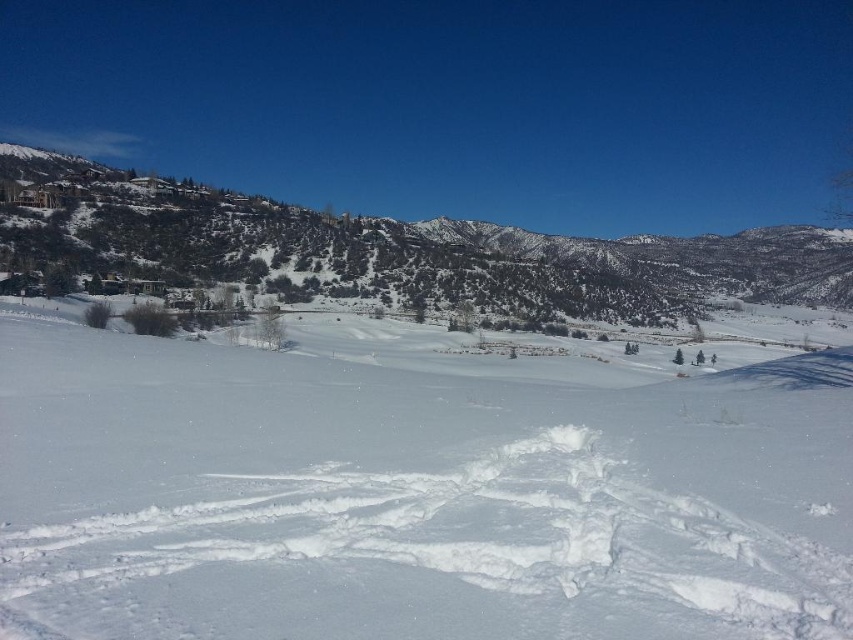
Question: Is white fluffy snow at center wider than green textured hillside at upper left?

Choices:
 (A) yes
 (B) no

Answer: (B)

Question: Does white fluffy snow at center have a smaller size compared to green textured hillside at upper left?

Choices:
 (A) no
 (B) yes

Answer: (B)

Question: Is white fluffy snow at center thinner than green textured hillside at upper left?

Choices:
 (A) yes
 (B) no

Answer: (A)

Question: Which point is farther to the camera?

Choices:
 (A) (701, 470)
 (B) (602, 256)

Answer: (B)

Question: Which of the following is the farthest from the observer?

Choices:
 (A) white fluffy snow at center
 (B) green textured hillside at upper left

Answer: (B)

Question: Among these points, which one is farthest from the camera?

Choices:
 (A) (138, 285)
 (B) (730, 573)

Answer: (A)